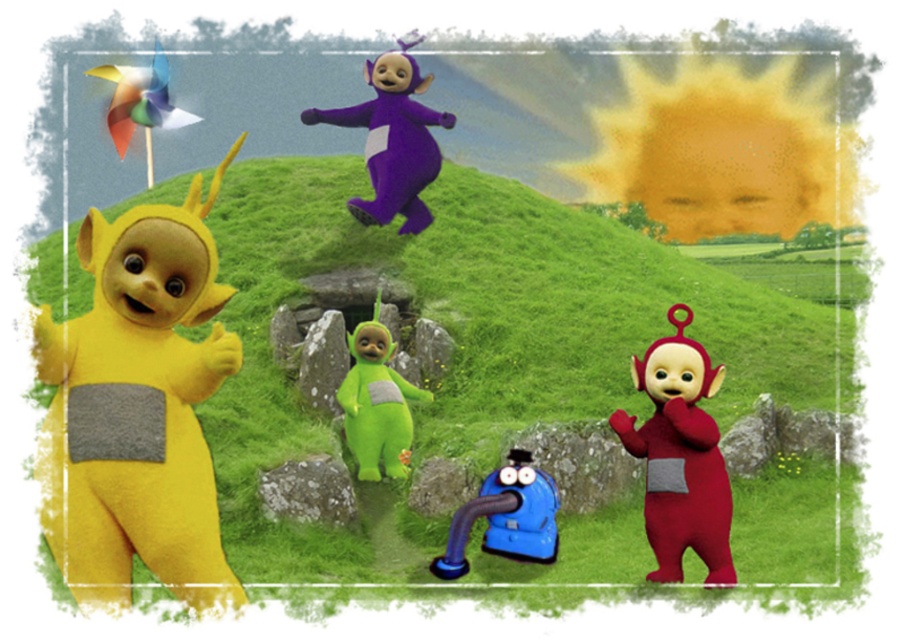
At what (x,y) coordinates should I click in order to perform the action: click on soft yellow plush at left. Please return your answer as a coordinate pair (x, y). Looking at the image, I should click on (137, 408).

Is point (163, 532) more distant than point (149, 164)?

No.

Locate an element on the screen. Image resolution: width=905 pixels, height=640 pixels. soft yellow plush at left is located at coordinates (137, 408).

Is point (525, 556) positioned after point (144, 68)?

No.

Can you confirm if blue rubber toy at center is taller than rainbow plastic pinwheel at upper left?

No.

Is point (456, 550) closer to viewer compared to point (143, 99)?

That is True.

What are the coordinates of `blue rubber toy at center` in the screenshot? It's located at (505, 516).

Which is in front, point (388, 410) or point (141, 72)?

Point (388, 410) is in front.

Is point (398, 408) more distant than point (137, 92)?

That is False.

At what (x,y) coordinates should I click in order to perform the action: click on green felt teletubby at center. Please return your answer as a coordinate pair (x, y). Looking at the image, I should click on (376, 403).